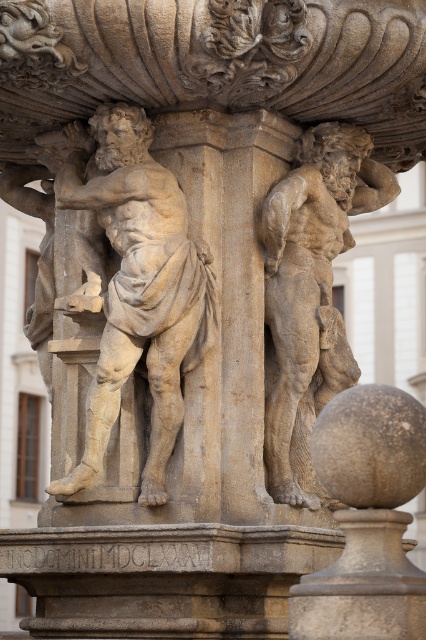
Who is positioned more to the right, beige stone statue at center or stone textured figure at center?

stone textured figure at center

Is beige stone statue at center in front of stone textured figure at center?

Yes, beige stone statue at center is in front of stone textured figure at center.

Is point (77, 152) positioned before point (321, 392)?

No.

Where is `beige stone statue at center`? The image size is (426, 640). beige stone statue at center is located at coordinates (135, 285).